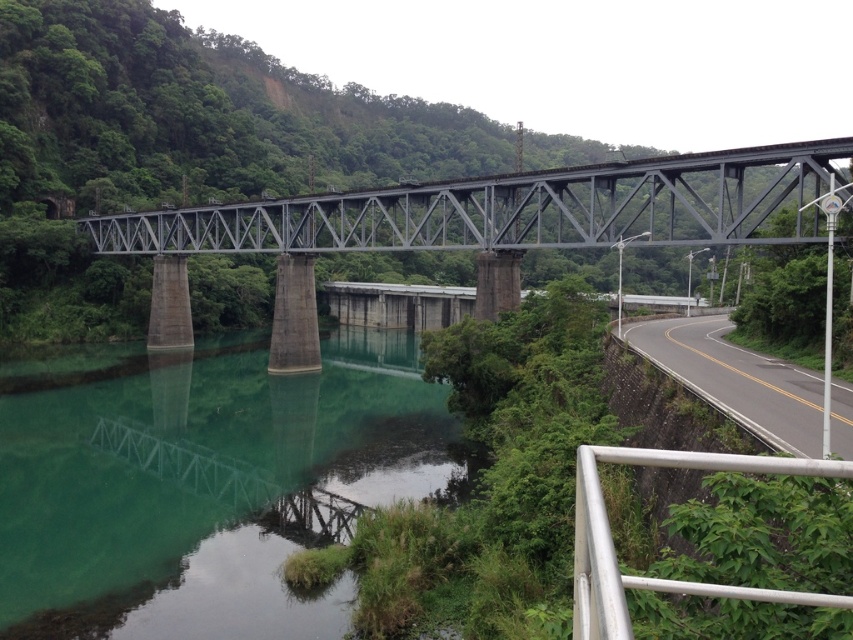
Can you confirm if metal bridge at center is bigger than black asphalt road at lower right?

Yes, metal bridge at center is bigger than black asphalt road at lower right.

This screenshot has height=640, width=853. What do you see at coordinates (473, 227) in the screenshot?
I see `metal bridge at center` at bounding box center [473, 227].

Is point (717, 216) positioned in front of point (700, 358)?

That is False.

I want to click on metal bridge at center, so click(x=473, y=227).

Is green concrete river at center thinner than metal bridge at center?

Correct, green concrete river at center's width is less than metal bridge at center's.

Is point (15, 406) less distant than point (589, 186)?

No, it is not.

You are a GUI agent. You are given a task and a screenshot of the screen. Output one action in this format:
    pyautogui.click(x=<x>, y=<y>)
    Task: Click on the green concrete river at center
    This screenshot has width=853, height=640.
    Given the screenshot: What is the action you would take?
    pyautogui.click(x=206, y=486)

Can you confirm if green concrete river at center is bigger than silver metallic railing at lower right?

Yes, green concrete river at center is bigger than silver metallic railing at lower right.

Does green concrete river at center come behind silver metallic railing at lower right?

Yes, green concrete river at center is further from the viewer.

Which is behind, point (36, 548) or point (595, 477)?

Point (36, 548)

Locate an element on the screen. The image size is (853, 640). green concrete river at center is located at coordinates (206, 486).